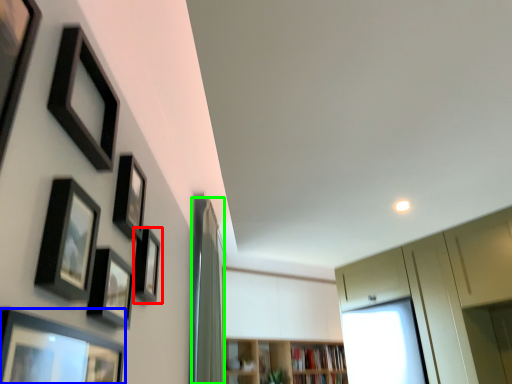
Question: Which object is the farthest from picture frame (highlighted by a red box)? Choose among these: picture frame (highlighted by a blue box) or curtain (highlighted by a green box).

Choices:
 (A) picture frame
 (B) curtain

Answer: (B)